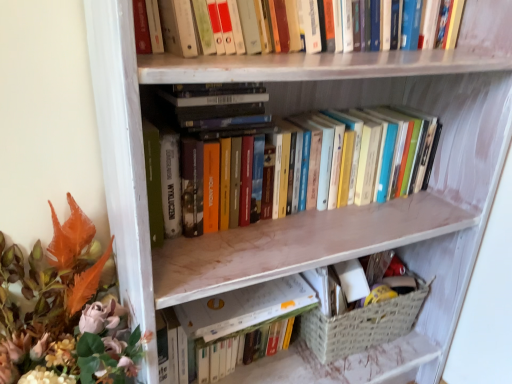
Image resolution: width=512 pixels, height=384 pixels. I want to click on free space above woven beige basket at lower right (from a real-world perspective), so click(371, 291).